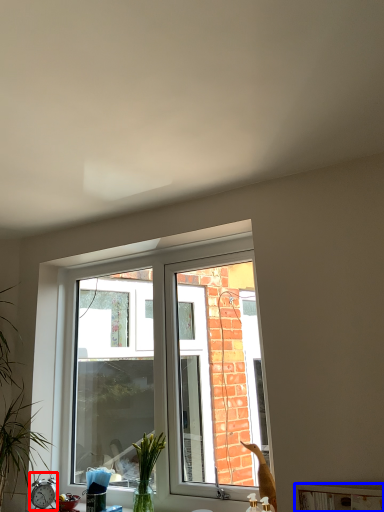
Question: Which point is closer to the camera, alarm clock (highlighted by a red box) or window sill (highlighted by a blue box)?

Choices:
 (A) alarm clock
 (B) window sill

Answer: (B)